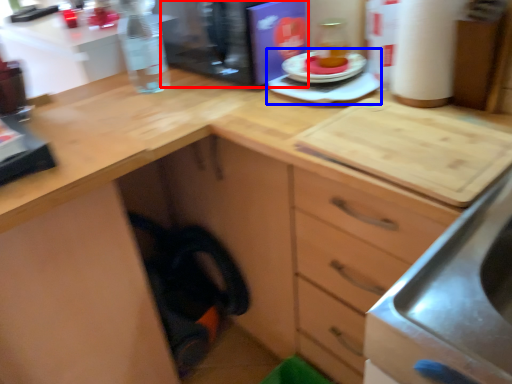
Question: Among these objects, which one is farthest to the camera, appliance (highlighted by a red box) or appliance (highlighted by a blue box)?

Choices:
 (A) appliance
 (B) appliance

Answer: (A)